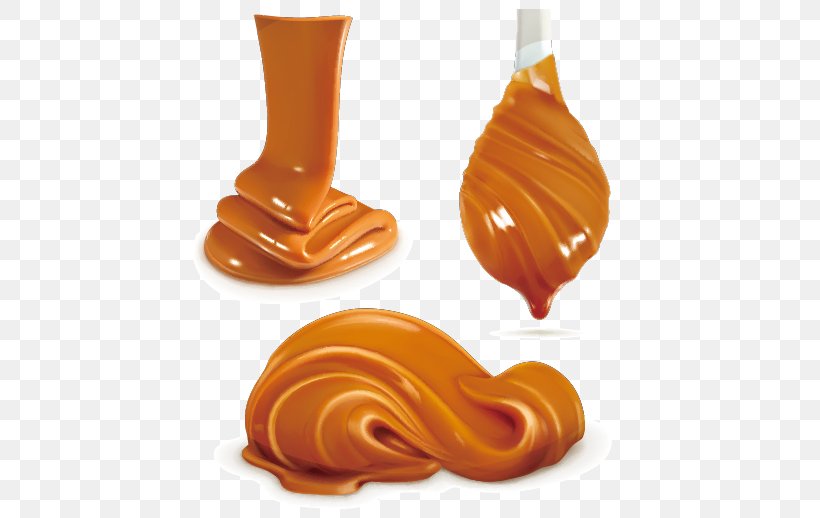
The image size is (820, 518). In order to click on spoon in this screenshot , I will do `click(531, 193)`.